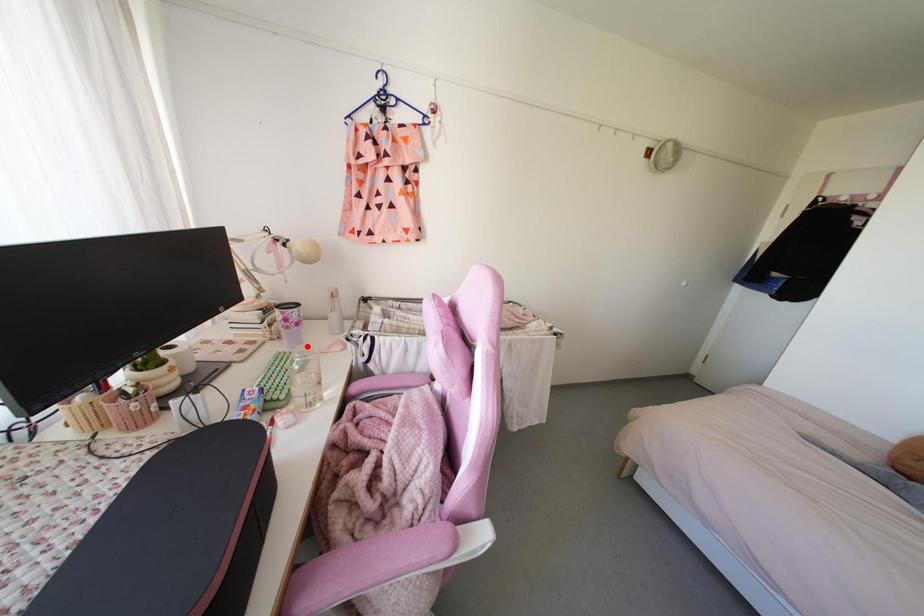
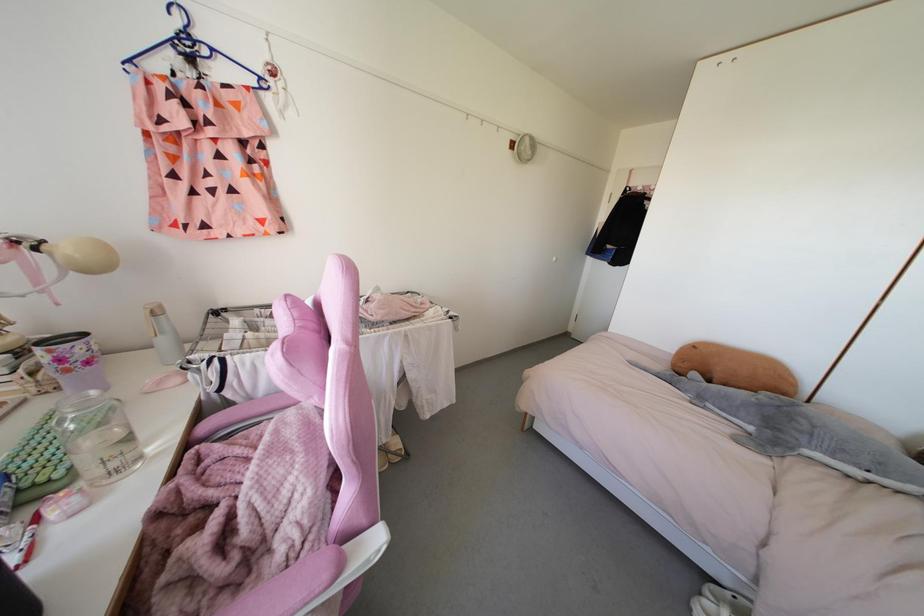
In the second image, find the point that corresponds to the highlighted location in the first image.

(92, 392)